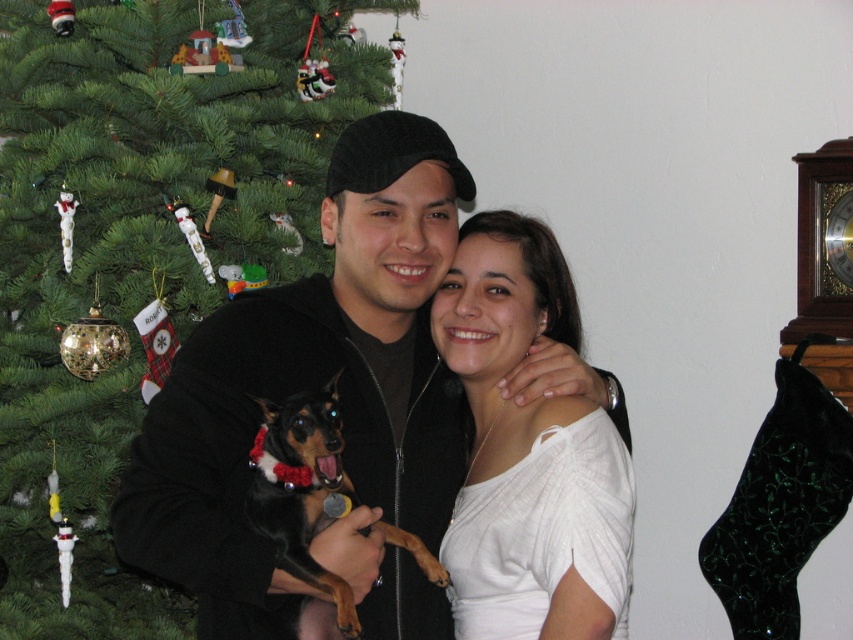
The width and height of the screenshot is (853, 640). What are the coordinates of `green matte christmas tree at left` in the screenshot? It's located at (137, 250).

Is green matte christmas tree at left bigger than white matte shirt at center?

Yes, green matte christmas tree at left is bigger than white matte shirt at center.

Which is in front, point (193, 28) or point (514, 268)?

Point (514, 268) is in front.

I want to click on green matte christmas tree at left, so click(x=137, y=250).

In the scene shown: Who is positioned more to the left, white matte shirt at center or black shiny dog at center?

black shiny dog at center

Is white matte shirt at center bigger than black shiny dog at center?

Indeed, white matte shirt at center has a larger size compared to black shiny dog at center.

Identify the location of white matte shirt at center. (527, 452).

Does point (15, 515) come in front of point (320, 426)?

No, it is behind (320, 426).

Between point (171, 624) and point (387, 536), which one is positioned in front?

Positioned in front is point (387, 536).

Is point (111, 563) positioned behind point (271, 477)?

That is True.

Locate an element on the screen. The width and height of the screenshot is (853, 640). green matte christmas tree at left is located at coordinates (137, 250).